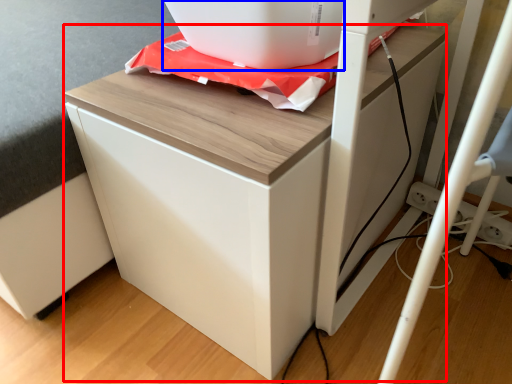
Question: Which point is further to the camera, furniture (highlighted by a red box) or appliance (highlighted by a blue box)?

Choices:
 (A) furniture
 (B) appliance

Answer: (B)